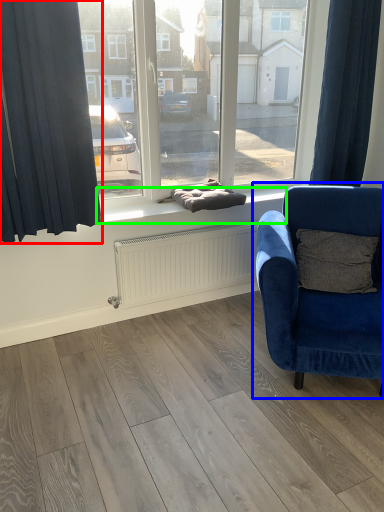
Question: Based on their relative distances, which object is nearer to curtain (highlighted by a red box)? Choose from chair (highlighted by a blue box) and window sill (highlighted by a green box).

Choices:
 (A) chair
 (B) window sill

Answer: (B)